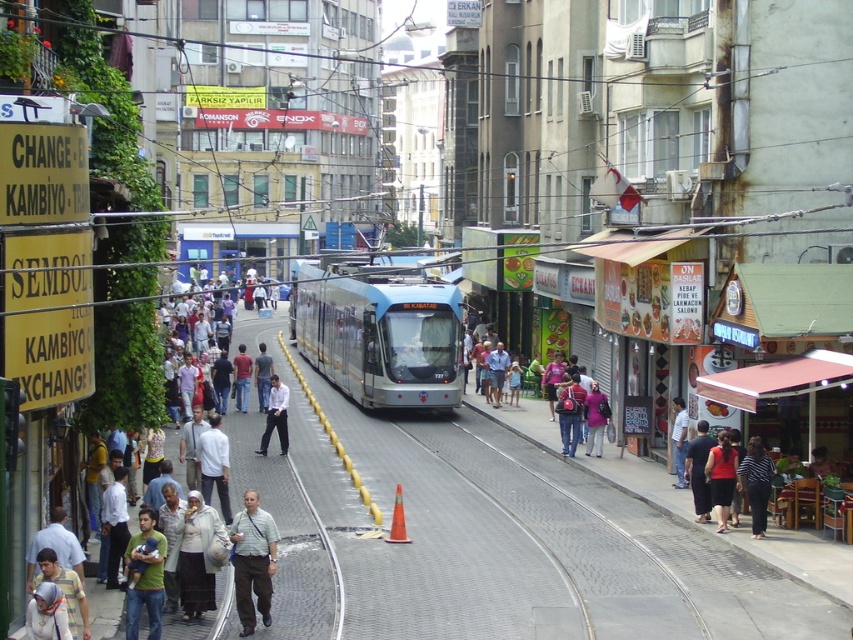
Is light brown leather jacket at center wider than green cotton shirt at center?

Yes.

Image resolution: width=853 pixels, height=640 pixels. What do you see at coordinates (103, 611) in the screenshot?
I see `light brown leather jacket at center` at bounding box center [103, 611].

This screenshot has height=640, width=853. What do you see at coordinates (103, 611) in the screenshot? I see `light brown leather jacket at center` at bounding box center [103, 611].

Locate an element on the screen. light brown leather jacket at center is located at coordinates (103, 611).

Who is positioned more to the right, light brown leather jacket at center or striped fabric shirt at center?

Positioned to the right is striped fabric shirt at center.

Locate an element on the screen. Image resolution: width=853 pixels, height=640 pixels. light brown leather jacket at center is located at coordinates (103, 611).

Which is in front, point (151, 557) or point (283, 449)?

Positioned in front is point (151, 557).

Is point (132, 627) farther from viewer compared to point (267, 426)?

That is False.

You are a GUI agent. You are given a task and a screenshot of the screen. Output one action in this format:
    pyautogui.click(x=<x>, y=<y>)
    Task: Click on the green cotton shirt at center
    
    Given the screenshot: What is the action you would take?
    pyautogui.click(x=144, y=577)